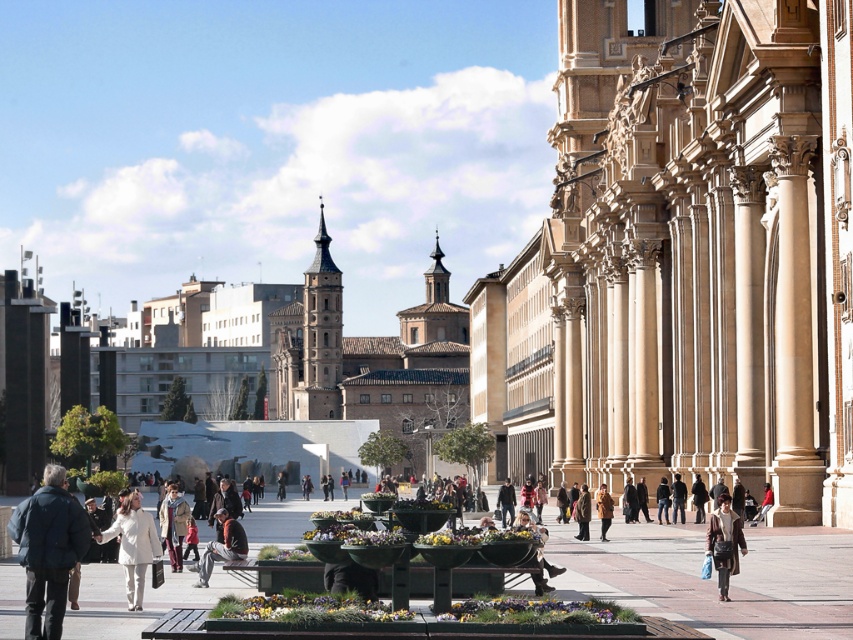
You are standing at the center of the plaza and want to walk towards the point marked as point [202,573]. Will you pass by point [660,488] before reaching your destination?

No, because point [202,573] is in front of point [660,488]. So you will reach point [202,573] before passing point [660,488].

You are standing in the plaza and see both the white wool coat at center and the denim jacket at center. Which one is positioned to the left?

The white wool coat at center is positioned to the left of the denim jacket at center.